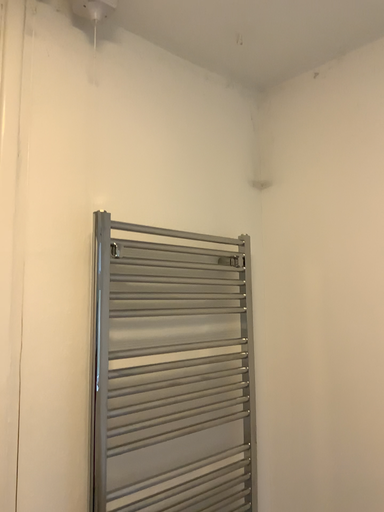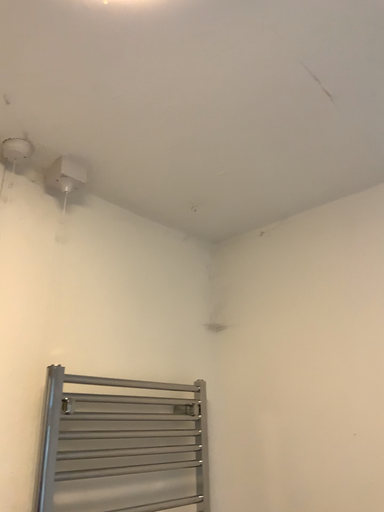
Question: How did the camera likely rotate when shooting the video?

Choices:
 (A) rotated downward
 (B) rotated upward

Answer: (B)